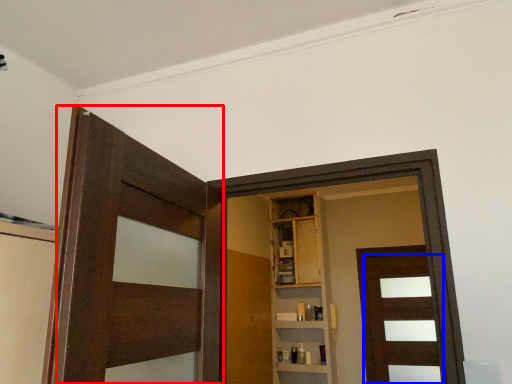
Question: Among these objects, which one is nearest to the camera, door (highlighted by a red box) or door (highlighted by a blue box)?

Choices:
 (A) door
 (B) door

Answer: (A)